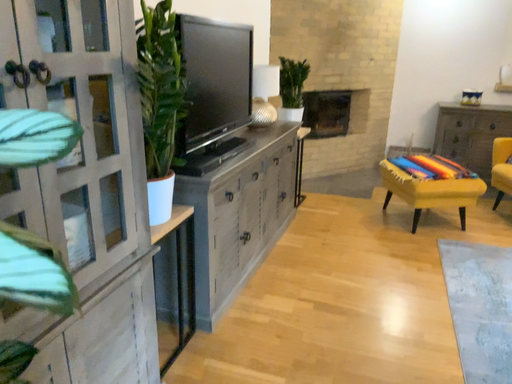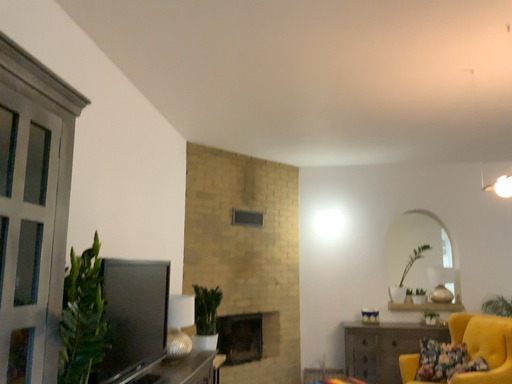
Question: How did the camera likely rotate when shooting the video?

Choices:
 (A) rotated upward
 (B) rotated downward

Answer: (A)